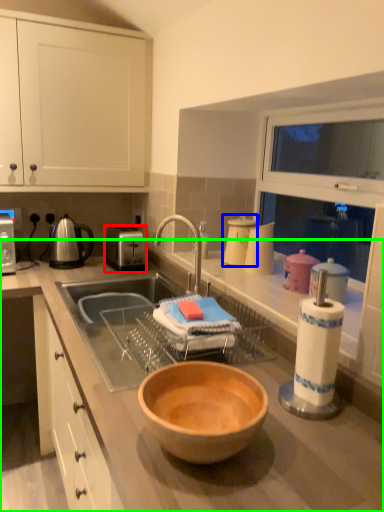
Question: Based on their relative distances, which object is nearer to toaster (highlighted by a red box)? Choose from appliance (highlighted by a blue box) and countertop (highlighted by a green box).

Choices:
 (A) appliance
 (B) countertop

Answer: (B)